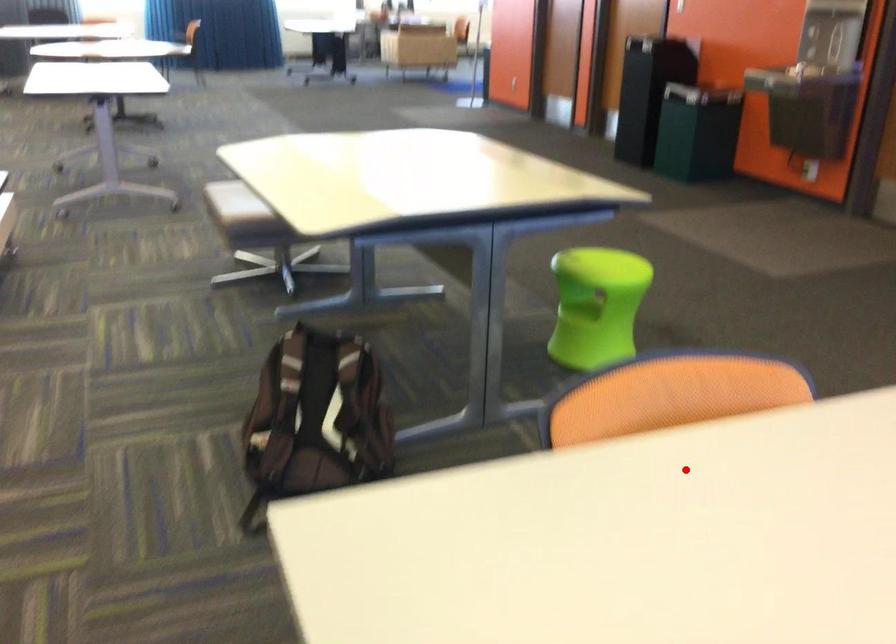
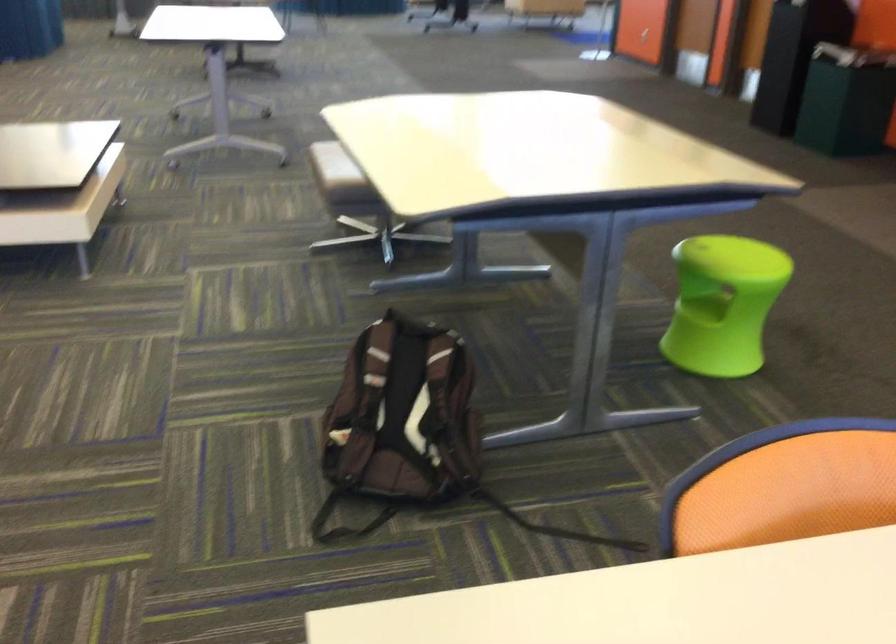
Question: I am providing you with two images of the same scene from different viewpoints. Given a red point in image1, look at the same physical point in image2. Is it:

Choices:
 (A) Closer to the viewpoint
 (B) Farther from the viewpoint

Answer: (A)